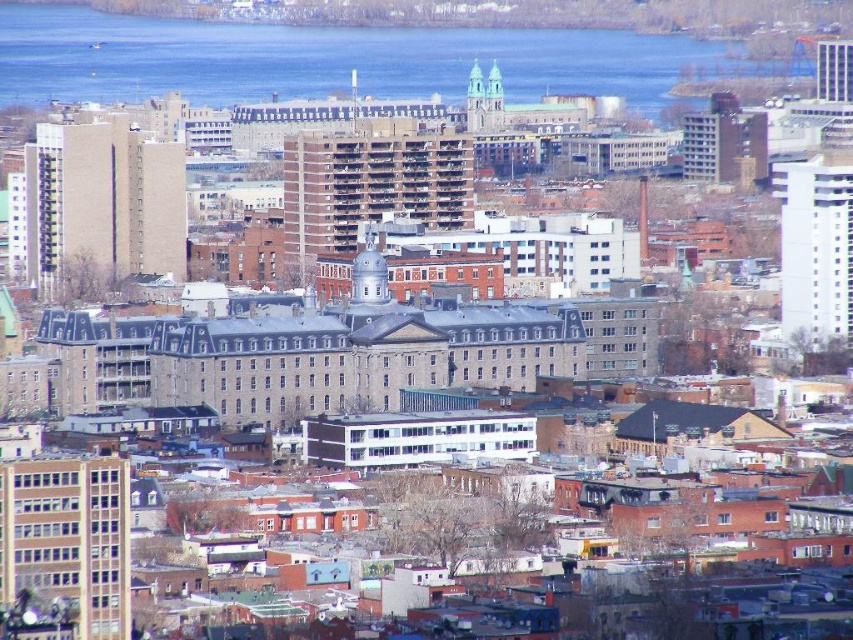
You are an urban planner analyzing the city layout. Given the brick textured building at center and the metallic glass skyscraper at upper right, which one is located to the east if the city is oriented with the skyscraper facing west?

The brick textured building at center is positioned on the left side of metallic glass skyscraper at upper right. Since the skyscraper faces west, its left side would be towards the north, meaning the brick textured building at center is to the north of the metallic glass skyscraper at upper right. Therefore, the metallic glass skyscraper at upper right is located to the east of the brick textured building at center.

You are an urban planner analyzing the cityscape. Given the brick textured building at center and the metallic glass skyscraper at upper right, which one would cast a longer shadow during midday when the sun is directly overhead?

The brick textured building at center is taller than the metallic glass skyscraper at upper right, so it would cast a longer shadow during midday when the sun is directly overhead.

You are an architect analyzing the city layout. From your current position, which of the two structures, the white smooth building at right or the white stone church at upper center, is positioned higher in the image?

The white stone church at upper center is positioned higher in the image than the white smooth building at right.